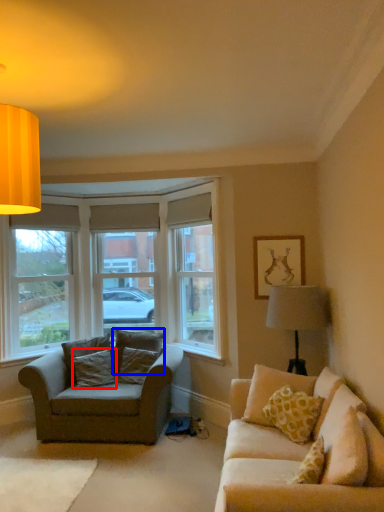
Question: Which point is closer to the camera, pillow (highlighted by a red box) or pillow (highlighted by a blue box)?

Choices:
 (A) pillow
 (B) pillow

Answer: (A)